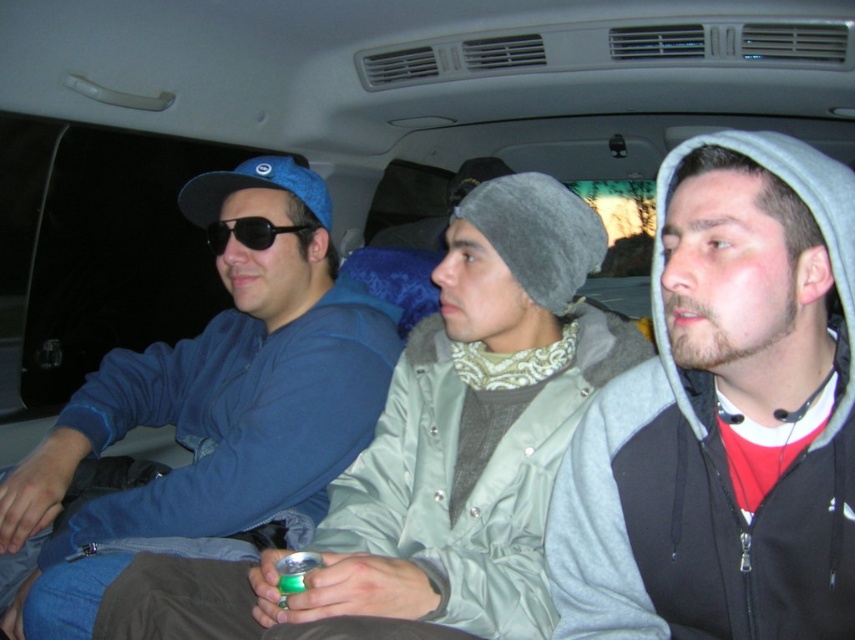
Which is in front, point (304, 451) or point (296, 230)?

Point (304, 451) is in front.

Does matte blue hoodie at left have a greater width compared to black matte sunglasses at center?

Yes.

Which is behind, point (127, 358) or point (222, 241)?

Point (127, 358)

The image size is (855, 640). I want to click on matte blue hoodie at left, so click(x=213, y=410).

In the scene shown: Is gray fleece hoodie at right thinner than black matte sunglasses at center?

In fact, gray fleece hoodie at right might be wider than black matte sunglasses at center.

Which is more to the right, gray fleece hoodie at right or black matte sunglasses at center?

Positioned to the right is gray fleece hoodie at right.

What do you see at coordinates (724, 416) in the screenshot?
I see `gray fleece hoodie at right` at bounding box center [724, 416].

At what (x,y) coordinates should I click in order to perform the action: click on gray fleece hoodie at right. Please return your answer as a coordinate pair (x, y). The width and height of the screenshot is (855, 640). Looking at the image, I should click on (724, 416).

Is gray fleece hoodie at right to the right of matte blue hoodie at left from the viewer's perspective?

Yes, gray fleece hoodie at right is to the right of matte blue hoodie at left.

Is gray fleece hoodie at right smaller than matte blue hoodie at left?

Yes.

Describe the element at coordinates (724, 416) in the screenshot. This screenshot has width=855, height=640. I see `gray fleece hoodie at right` at that location.

Identify the location of gray fleece hoodie at right. The height and width of the screenshot is (640, 855). (724, 416).